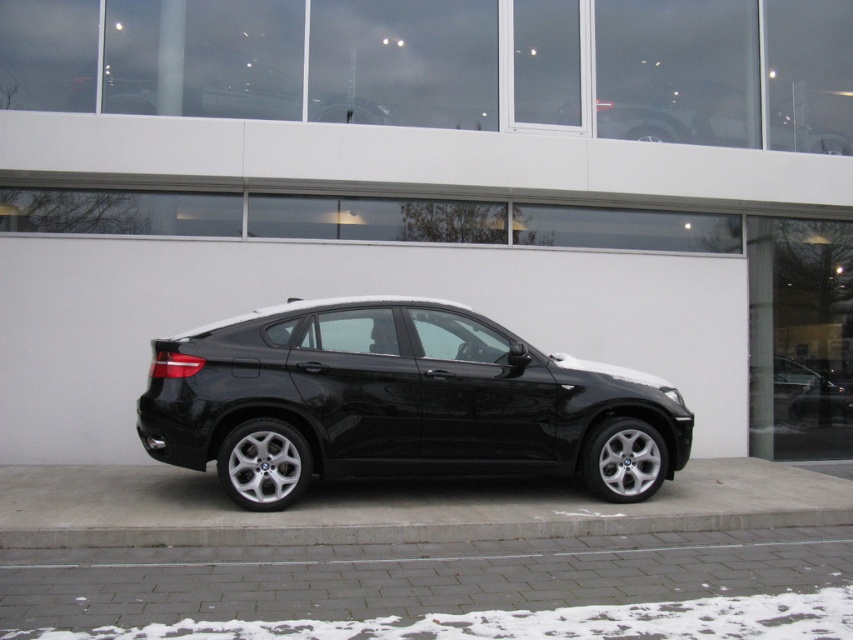
From the picture: You are a delivery driver who needs to park your vehicle on the gray brick pavement at lower center and the concrete at lower center. According to the scene, which surface is located to the right of the other?

The gray brick pavement at lower center is to the right of the concrete at lower center.

You are a delivery person trying to park a new black metallic car at center in the parking lot. The parking spot is marked by concrete at lower center. Can you park the car in this spot without driving over any other areas?

The black metallic car at center is positioned over concrete at lower center, so yes, the car is already parked correctly on the concrete at lower center without driving over other areas.

You are standing at the point closest to the camera in the image. Which point, point (492, 582) or point (376, 525), are you currently at?

You are at point (492, 582) because it is in front of point (376, 525), meaning it is closer to the camera.